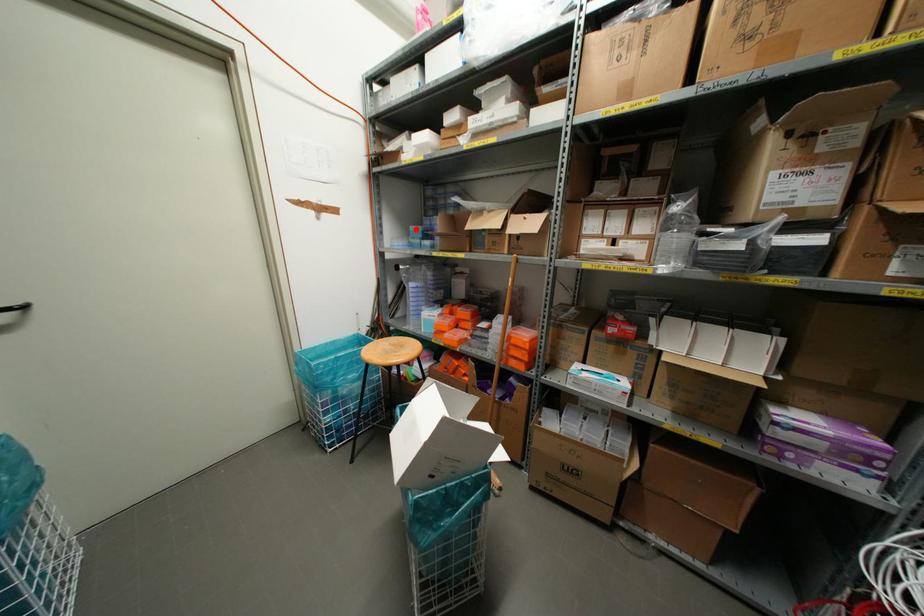
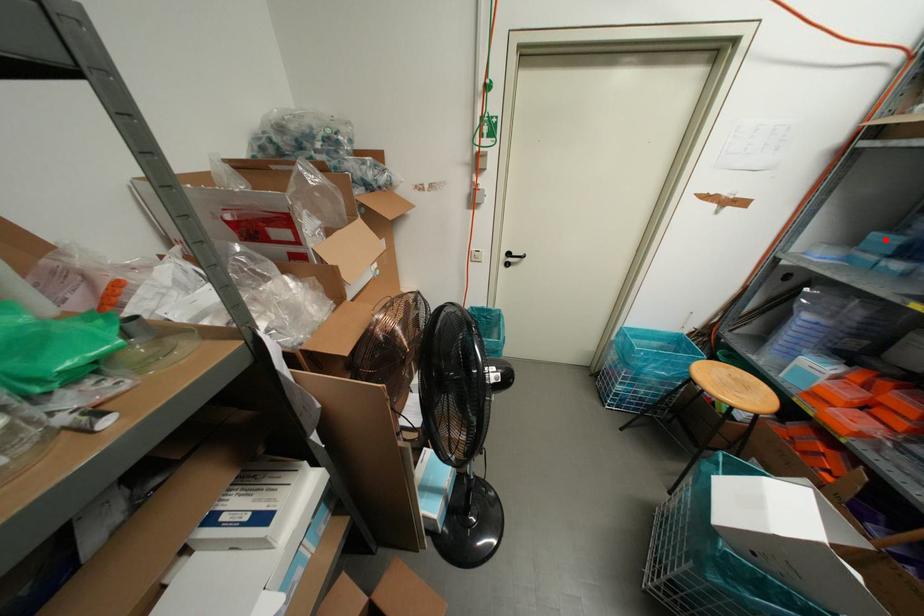
I am providing you with two images of the same scene from different viewpoints. A red point is marked on the first image and another point is marked on the second image. Is the marked point in image1 the same physical position as the marked point in image2?

Yes